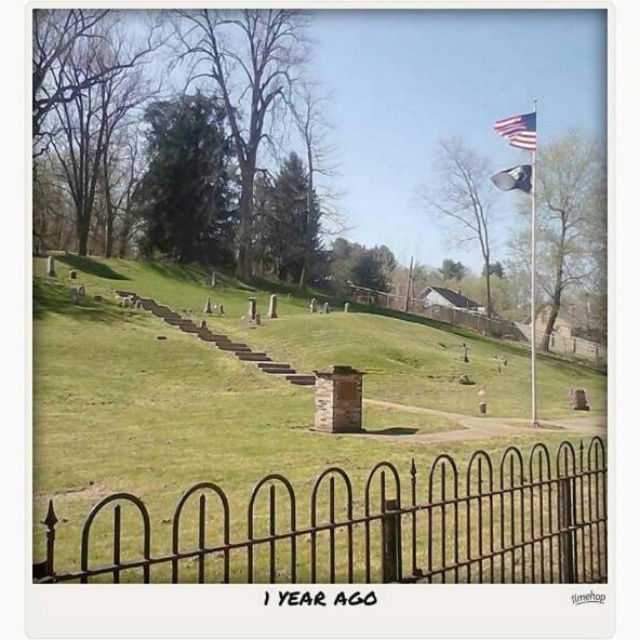
Is metallic flag pole at upper right thinner than silky blue flag at upper right?

No.

In order to click on metallic flag pole at upper right in this screenshot , I will do `click(532, 266)`.

Find the location of a particular element. This screenshot has width=640, height=640. metallic flag pole at upper right is located at coordinates (532, 266).

I want to click on metallic flag pole at upper right, so click(532, 266).

Which is more to the right, brown wrought iron fence at lower center or american flag at upper right?

american flag at upper right is more to the right.

Is point (509, 481) behind point (520, 122)?

No, (509, 481) is closer to viewer.

Identify the location of brown wrought iron fence at lower center. Image resolution: width=640 pixels, height=640 pixels. (365, 525).

Does green grassy hillside at center have a lesser height compared to metallic flag pole at upper right?

Correct, green grassy hillside at center is not as tall as metallic flag pole at upper right.

Which is in front, point (410, 346) or point (532, 289)?

Positioned in front is point (410, 346).

Locate an element on the screen. The image size is (640, 640). green grassy hillside at center is located at coordinates (296, 445).